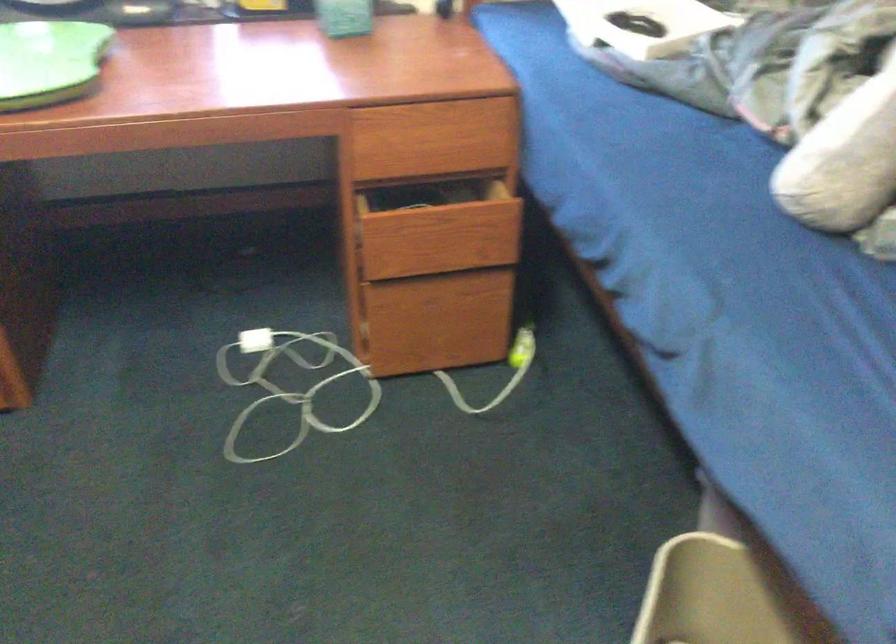
This screenshot has height=644, width=896. What do you see at coordinates (521, 346) in the screenshot?
I see `a yellow cable connector` at bounding box center [521, 346].